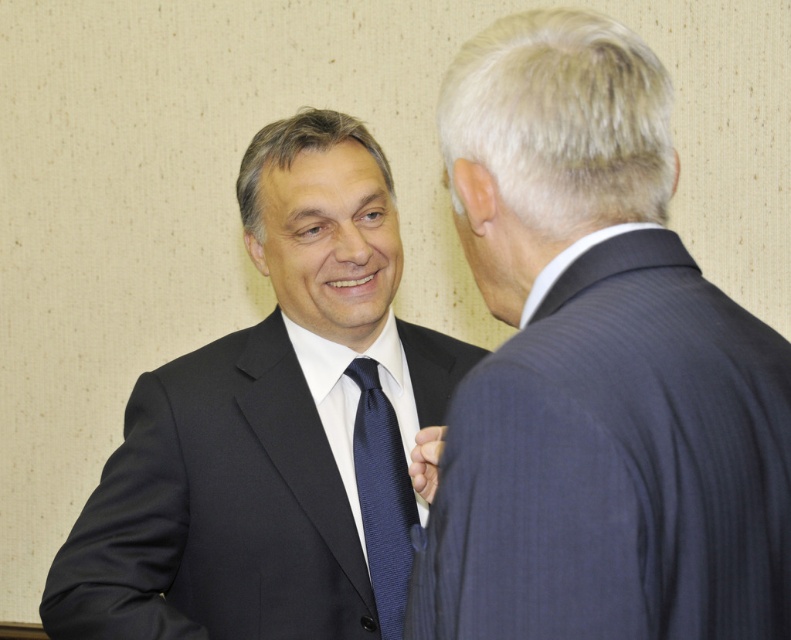
Question: Is the position of dark blue pinstripe suit at right more distant than that of matte black suit at center?

Choices:
 (A) no
 (B) yes

Answer: (A)

Question: Which point is closer to the camera taking this photo?

Choices:
 (A) (385, 456)
 (B) (513, 355)
 (C) (167, 480)

Answer: (B)

Question: Among these points, which one is nearest to the camera?

Choices:
 (A) (619, 538)
 (B) (398, 464)

Answer: (A)

Question: Is dark blue pinstripe suit at right closer to camera compared to navy silk tie at center?

Choices:
 (A) yes
 (B) no

Answer: (A)

Question: Among these points, which one is nearest to the camera?

Choices:
 (A) (456, 108)
 (B) (165, 627)

Answer: (A)

Question: Does dark blue pinstripe suit at right have a smaller size compared to navy silk tie at center?

Choices:
 (A) no
 (B) yes

Answer: (A)